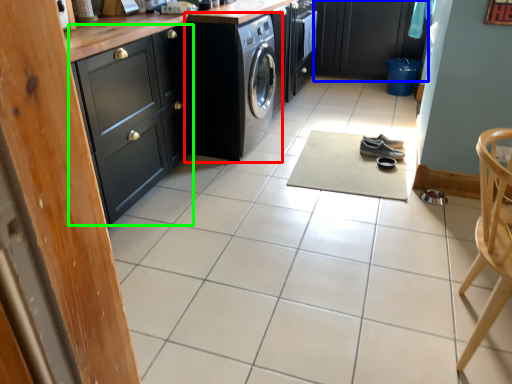
Question: Estimate the real-world distances between objects in this image. Which object is closer to washing machine (highlighted by a red box), cabinetry (highlighted by a blue box) or cabinetry (highlighted by a green box)?

Choices:
 (A) cabinetry
 (B) cabinetry

Answer: (B)